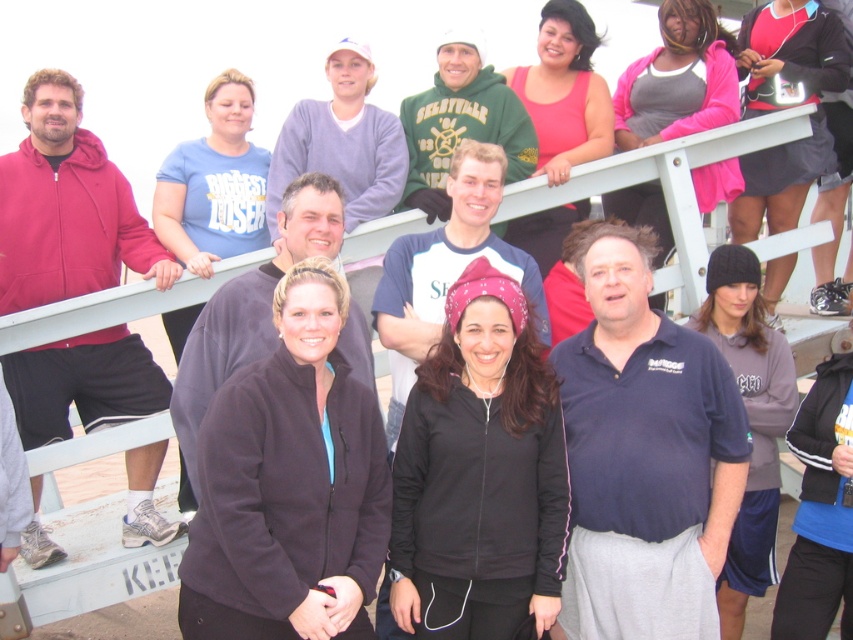
Between point (28, 298) and point (440, 234), which one is positioned in front?

Point (28, 298) is in front.

Is matte red hoodie at left to the right of pink bandana at center from the viewer's perspective?

Incorrect, matte red hoodie at left is not on the right side of pink bandana at center.

Is point (56, 145) farther from camera compared to point (508, 266)?

That is False.

Identify the location of matte red hoodie at left. This screenshot has height=640, width=853. (67, 208).

Can you confirm if matte red hoodie at left is wider than dark gray fleece jacket at center?

No.

Is point (97, 240) farther from camera compared to point (181, 408)?

That is True.

Identify the location of matte red hoodie at left. Image resolution: width=853 pixels, height=640 pixels. (67, 208).

Can you confirm if dark blue polo shirt at center is positioned above pink bandana at center?

Incorrect, dark blue polo shirt at center is not positioned above pink bandana at center.

Between dark blue polo shirt at center and pink bandana at center, which one has more height?

Standing taller between the two is pink bandana at center.

Locate an element on the screen. The width and height of the screenshot is (853, 640). dark blue polo shirt at center is located at coordinates (643, 456).

Where is `dark blue polo shirt at center`? The height and width of the screenshot is (640, 853). dark blue polo shirt at center is located at coordinates (643, 456).